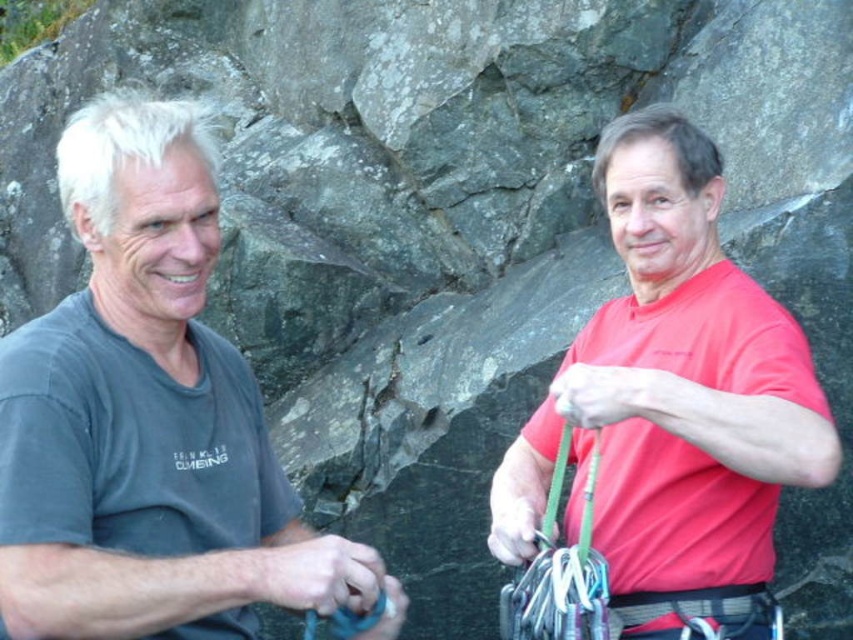
You are standing at the base of the rock face and see two points marked on the rock. The first point is at coordinate point[351,573] and the second is at point[635,330]. Which point is closer to you?

Point[351,573] is closer to you because it is in front of point[635,330].